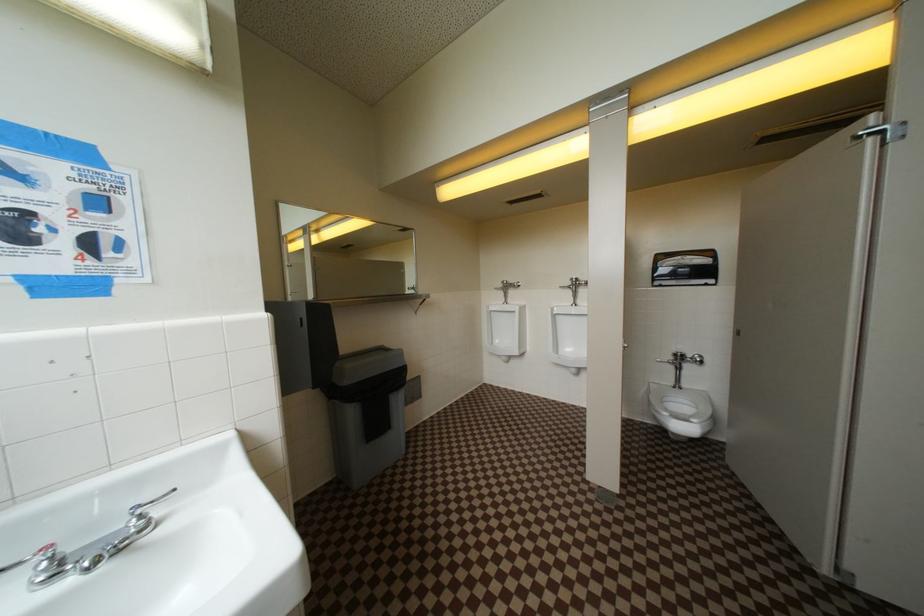
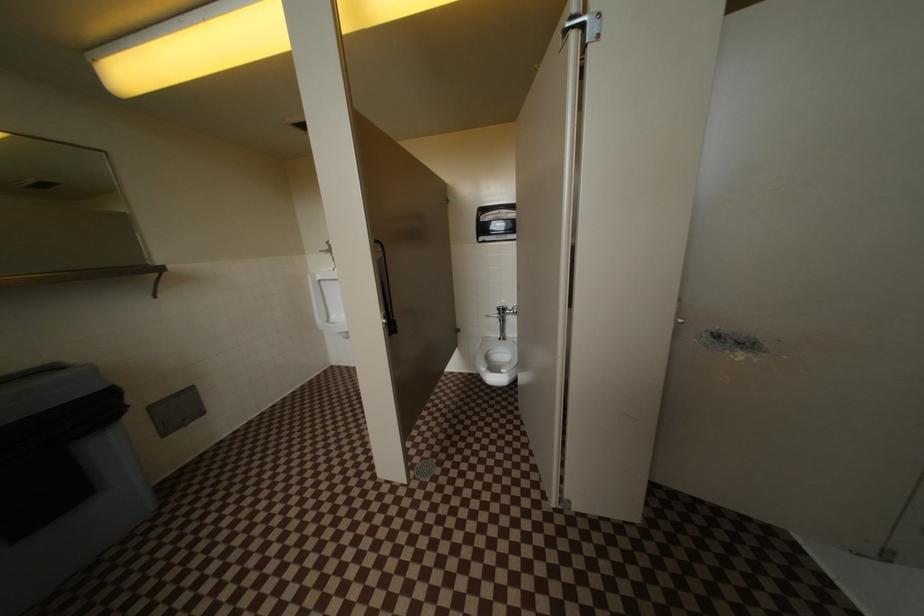
Which direction would the cameraman need to move to produce the second image?

The movement direction of the cameraman is right, forward.